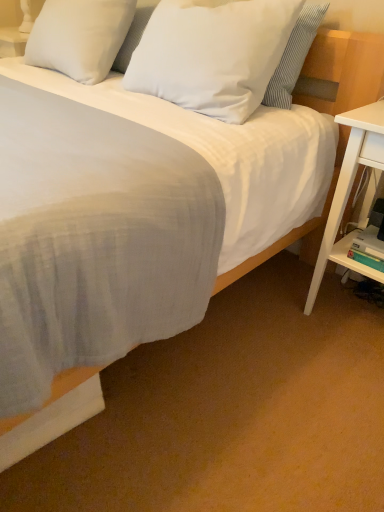
Where is `white plastic shelf at lower right`? The image size is (384, 512). white plastic shelf at lower right is located at coordinates (351, 259).

In the scene shown: Measure the distance between point (250, 8) and camera.

A distance of 1.26 meters exists between point (250, 8) and camera.

Identify the location of white soft pillow at upper center, which appears as the second pillow when viewed from the right. This screenshot has height=512, width=384. pos(79,37).

Identify the location of white plastic shelf at lower right. The height and width of the screenshot is (512, 384). (351, 259).

How many degrees apart are the facing directions of white matte pillow at upper center, which appears as the 1th pillow when viewed from the right, and white plastic shelf at lower right?

The facing directions of white matte pillow at upper center, which appears as the 1th pillow when viewed from the right, and white plastic shelf at lower right are 0.16 degrees apart.

From a real-world perspective, is white matte pillow at upper center, acting as the 2th pillow starting from the left, physically located above or below white plastic shelf at lower right?

From a real-world perspective, white matte pillow at upper center, acting as the 2th pillow starting from the left, is physically above white plastic shelf at lower right.

This screenshot has height=512, width=384. In order to click on pillow that is the 2nd object above the white plastic shelf at lower right (from a real-world perspective) in this screenshot , I will do `click(212, 54)`.

Is white matte pillow at upper center, acting as the 2th pillow starting from the left, oriented away from white plastic shelf at lower right?

No.

Consider the image. How many degrees apart are the facing directions of white soft pillow at upper center, placed as the 1th pillow when sorted from left to right, and white plastic shelf at lower right?

The angular difference between white soft pillow at upper center, placed as the 1th pillow when sorted from left to right, and white plastic shelf at lower right is 0.16 degrees.

Is white soft pillow at upper center, placed as the 1th pillow when sorted from left to right, taller than white plastic shelf at lower right?

Correct, white soft pillow at upper center, placed as the 1th pillow when sorted from left to right, is much taller as white plastic shelf at lower right.

Is white soft pillow at upper center, placed as the 1th pillow when sorted from left to right, far away from white plastic shelf at lower right?

white soft pillow at upper center, placed as the 1th pillow when sorted from left to right, is far away from white plastic shelf at lower right.

Which object is wider, white soft pillow at upper center, placed as the 1th pillow when sorted from left to right, or white plastic shelf at lower right?

white soft pillow at upper center, placed as the 1th pillow when sorted from left to right.

Considering the relative positions of white soft pillow at upper center, placed as the 1th pillow when sorted from left to right, and white wood nightstand at right in the image provided, is white soft pillow at upper center, placed as the 1th pillow when sorted from left to right, to the right of white wood nightstand at right from the viewer's perspective?

No, white soft pillow at upper center, placed as the 1th pillow when sorted from left to right, is not to the right of white wood nightstand at right.

In the image, is white soft pillow at upper center, which appears as the second pillow when viewed from the right, positioned in front of or behind white wood nightstand at right?

Visually, white soft pillow at upper center, which appears as the second pillow when viewed from the right, is located behind white wood nightstand at right.

Is white soft pillow at upper center, which appears as the second pillow when viewed from the right, in contact with white wood nightstand at right?

No, white soft pillow at upper center, which appears as the second pillow when viewed from the right, is not with white wood nightstand at right.

Is white soft pillow at upper center, which appears as the second pillow when viewed from the right, not inside white wood nightstand at right?

Absolutely, white soft pillow at upper center, which appears as the second pillow when viewed from the right, is external to white wood nightstand at right.

Is white plastic shelf at lower right positioned with its back to white matte pillow at upper center, acting as the 2th pillow starting from the left?

No, white matte pillow at upper center, acting as the 2th pillow starting from the left, is not at the back of white plastic shelf at lower right.

Considering the positions of points (370, 270) and (231, 46), is point (370, 270) closer to camera compared to point (231, 46)?

No, it is behind (231, 46).

Is there a large distance between white plastic shelf at lower right and white matte pillow at upper center, acting as the 2th pillow starting from the left?

white plastic shelf at lower right is near white matte pillow at upper center, acting as the 2th pillow starting from the left, not far away.

Is white matte pillow at upper center, which appears as the 1th pillow when viewed from the right, thinner than white wood nightstand at right?

Correct, the width of white matte pillow at upper center, which appears as the 1th pillow when viewed from the right, is less than that of white wood nightstand at right.

From a real-world perspective, which is physically above, white matte pillow at upper center, which appears as the 1th pillow when viewed from the right, or white wood nightstand at right?

In real-world perspective, white matte pillow at upper center, which appears as the 1th pillow when viewed from the right, is above.

Which pillow is the 1st one when counting from the back of the white wood nightstand at right? Please provide its 2D coordinates.

[(212, 54)]

Based on the photo, who is smaller, white matte pillow at upper center, acting as the 2th pillow starting from the left, or white wood nightstand at right?

white matte pillow at upper center, acting as the 2th pillow starting from the left, is smaller.

Between white soft pillow at upper center, placed as the 1th pillow when sorted from left to right, and white matte pillow at upper center, which appears as the 1th pillow when viewed from the right, which one appears on the right side from the viewer's perspective?

Positioned to the right is white matte pillow at upper center, which appears as the 1th pillow when viewed from the right.

How different are the orientations of white soft pillow at upper center, which appears as the second pillow when viewed from the right, and white matte pillow at upper center, acting as the 2th pillow starting from the left, in degrees?

The facing directions of white soft pillow at upper center, which appears as the second pillow when viewed from the right, and white matte pillow at upper center, acting as the 2th pillow starting from the left, are 0.000167 degrees apart.

Does point (105, 38) come behind point (243, 83)?

That is True.

Is the position of white wood nightstand at right less distant than that of white soft pillow at upper center, which appears as the second pillow when viewed from the right?

Yes.

Is white wood nightstand at right taller or shorter than white soft pillow at upper center, which appears as the second pillow when viewed from the right?

In the image, white wood nightstand at right appears to be taller than white soft pillow at upper center, which appears as the second pillow when viewed from the right.

The width and height of the screenshot is (384, 512). I want to click on nightstand in front of the white soft pillow at upper center, which appears as the second pillow when viewed from the right, so tap(350, 191).

Find the location of `shelf on the right of white matte pillow at upper center, acting as the 2th pillow starting from the left`. shelf on the right of white matte pillow at upper center, acting as the 2th pillow starting from the left is located at coordinates (351, 259).

Identify the location of shelf below the white soft pillow at upper center, which appears as the second pillow when viewed from the right (from a real-world perspective). This screenshot has width=384, height=512. (351, 259).

Which object lies nearer to the anchor point white soft pillow at upper center, placed as the 1th pillow when sorted from left to right, white wood nightstand at right or white matte pillow at upper center, which appears as the 1th pillow when viewed from the right?

white matte pillow at upper center, which appears as the 1th pillow when viewed from the right, is closer to white soft pillow at upper center, placed as the 1th pillow when sorted from left to right.

Which object lies further to the anchor point white matte pillow at upper center, which appears as the 1th pillow when viewed from the right, white soft pillow at upper center, placed as the 1th pillow when sorted from left to right, or white wood nightstand at right?

Among the two, white wood nightstand at right is located further to white matte pillow at upper center, which appears as the 1th pillow when viewed from the right.

Looking at the image, which one is located closer to white soft pillow at upper center, placed as the 1th pillow when sorted from left to right, white plastic shelf at lower right or white matte pillow at upper center, acting as the 2th pillow starting from the left?

white matte pillow at upper center, acting as the 2th pillow starting from the left, is positioned closer to the anchor white soft pillow at upper center, placed as the 1th pillow when sorted from left to right.

When comparing their distances from white plastic shelf at lower right, does white soft pillow at upper center, which appears as the second pillow when viewed from the right, or white wood nightstand at right seem further?

white soft pillow at upper center, which appears as the second pillow when viewed from the right, is positioned further to the anchor white plastic shelf at lower right.

Estimate the real-world distances between objects in this image. Which object is further from white plastic shelf at lower right, white wood nightstand at right or white matte pillow at upper center, acting as the 2th pillow starting from the left?

white matte pillow at upper center, acting as the 2th pillow starting from the left, is further to white plastic shelf at lower right.

Which object lies nearer to the anchor point white wood nightstand at right, white soft pillow at upper center, placed as the 1th pillow when sorted from left to right, or white plastic shelf at lower right?

white plastic shelf at lower right.

Estimate the real-world distances between objects in this image. Which object is closer to white plastic shelf at lower right, white soft pillow at upper center, which appears as the second pillow when viewed from the right, or white matte pillow at upper center, which appears as the 1th pillow when viewed from the right?

white matte pillow at upper center, which appears as the 1th pillow when viewed from the right, lies closer to white plastic shelf at lower right than the other object.

Estimate the real-world distances between objects in this image. Which object is further from white plastic shelf at lower right, white matte pillow at upper center, which appears as the 1th pillow when viewed from the right, or white wood nightstand at right?

white matte pillow at upper center, which appears as the 1th pillow when viewed from the right, is further to white plastic shelf at lower right.

Where is `nightstand between white soft pillow at upper center, placed as the 1th pillow when sorted from left to right, and white plastic shelf at lower right, in the horizontal direction`? The width and height of the screenshot is (384, 512). nightstand between white soft pillow at upper center, placed as the 1th pillow when sorted from left to right, and white plastic shelf at lower right, in the horizontal direction is located at coordinates (350, 191).

The image size is (384, 512). What are the coordinates of `nightstand between white matte pillow at upper center, acting as the 2th pillow starting from the left, and white plastic shelf at lower right from top to bottom` in the screenshot? It's located at (350, 191).

Locate an element on the screen. This screenshot has width=384, height=512. pillow located between white soft pillow at upper center, placed as the 1th pillow when sorted from left to right, and white plastic shelf at lower right in the left-right direction is located at coordinates (212, 54).

At what (x,y) coordinates should I click in order to perform the action: click on pillow between white soft pillow at upper center, placed as the 1th pillow when sorted from left to right, and white wood nightstand at right. Please return your answer as a coordinate pair (x, y). Looking at the image, I should click on (212, 54).